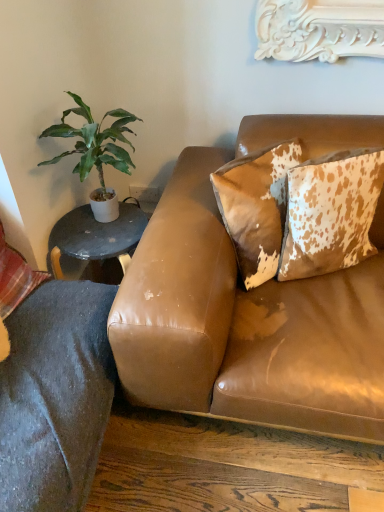
Question: Can you see brown textured pillow at upper right, which is counted as the second pillow, starting from the right, touching green leafy plant at left?

Choices:
 (A) yes
 (B) no

Answer: (B)

Question: Does brown textured pillow at upper right, which appears as the 2th pillow when viewed from the left, have a lesser height compared to green leafy plant at left?

Choices:
 (A) no
 (B) yes

Answer: (B)

Question: From a real-world perspective, is brown textured pillow at upper right, which is counted as the second pillow, starting from the right, positioned over green leafy plant at left based on gravity?

Choices:
 (A) no
 (B) yes

Answer: (A)

Question: Is brown textured pillow at upper right, which is counted as the second pillow, starting from the right, to the left of green leafy plant at left from the viewer's perspective?

Choices:
 (A) yes
 (B) no

Answer: (B)

Question: Does point (210, 351) appear closer or farther from the camera than point (289, 146)?

Choices:
 (A) farther
 (B) closer

Answer: (B)

Question: Based on their sizes in the image, would you say brown leather couch at upper right is bigger or smaller than brown textured pillow at upper right, which appears as the 2th pillow when viewed from the left?

Choices:
 (A) small
 (B) big

Answer: (B)

Question: Based on their positions, is brown leather couch at upper right located to the left or right of brown textured pillow at upper right, which appears as the 2th pillow when viewed from the left?

Choices:
 (A) left
 (B) right

Answer: (B)

Question: In terms of height, does brown leather couch at upper right look taller or shorter compared to brown textured pillow at upper right, which appears as the 2th pillow when viewed from the left?

Choices:
 (A) short
 (B) tall

Answer: (B)

Question: From the image's perspective, is brown leather couch at upper right located above or below plaid fabric pillow at lower left, which is counted as the first pillow, starting from the left?

Choices:
 (A) above
 (B) below

Answer: (B)

Question: Is point (281, 290) closer or farther from the camera than point (3, 243)?

Choices:
 (A) farther
 (B) closer

Answer: (B)

Question: Is brown leather couch at upper right spatially inside plaid fabric pillow at lower left, which is the 3th pillow from right to left, or outside of it?

Choices:
 (A) outside
 (B) inside

Answer: (A)

Question: From a real-world perspective, is brown leather couch at upper right positioned above or below plaid fabric pillow at lower left, which is the 3th pillow from right to left?

Choices:
 (A) below
 (B) above

Answer: (A)

Question: In terms of size, does cowhide pillow at upper right, the 1th pillow when ordered from right to left, appear bigger or smaller than brown textured pillow at upper right, which is counted as the second pillow, starting from the right?

Choices:
 (A) big
 (B) small

Answer: (B)

Question: In terms of height, does cowhide pillow at upper right, the 1th pillow when ordered from right to left, look taller or shorter compared to brown textured pillow at upper right, which appears as the 2th pillow when viewed from the left?

Choices:
 (A) tall
 (B) short

Answer: (A)